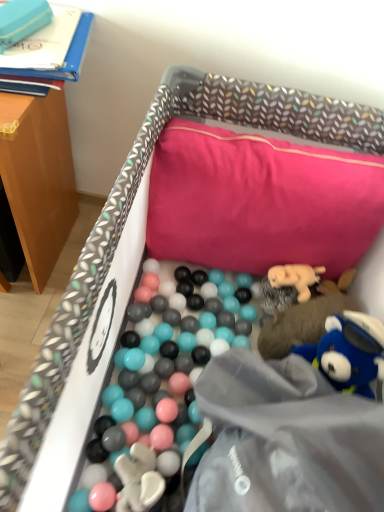
Question: In terms of size, does matte blue box at upper left, the fourth toy from the bottom, appear bigger or smaller than soft plush bear at upper right, the third toy viewed from the top?

Choices:
 (A) big
 (B) small

Answer: (B)

Question: Considering the positions of point (3, 51) and point (329, 298), is point (3, 51) closer or farther from the camera than point (329, 298)?

Choices:
 (A) closer
 (B) farther

Answer: (A)

Question: Based on their relative distances, which object is farther from the soft plush bear at upper right, arranged as the third toy when viewed from the left?

Choices:
 (A) pink fabric pillow at upper center
 (B) blue plush toy at lower right, arranged as the first toy when viewed from the right
 (C) wooden table at upper left
 (D) matte blue box at upper left, the 4th toy from the right
 (E) soft beige plush bear at center-right, the 3th toy ordered from the bottom

Answer: (D)

Question: Based on their relative distances, which object is nearer to the matte blue box at upper left, which is counted as the 1th toy, starting from the left?

Choices:
 (A) pink fabric pillow at upper center
 (B) soft plush bear at upper right, the 2th toy from the bottom
 (C) soft beige plush bear at center-right, which is counted as the second toy, starting from the left
 (D) wooden table at upper left
 (E) blue plush toy at lower right, the 4th toy viewed from the top

Answer: (D)